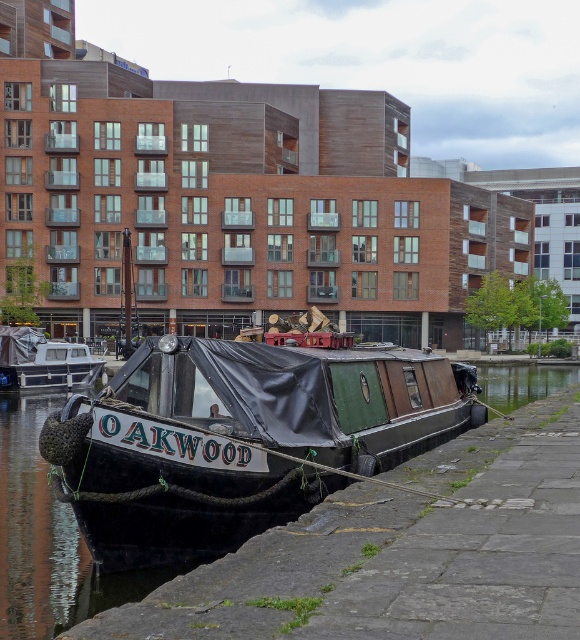
You are standing on the embankment and see both the black polished wood boat at center and the matte black boat at left. Which boat is closer to the modern building in the background?

The black polished wood boat at center is closer to the modern building in the background because it is positioned to the right of the matte black boat at left, which is further away from the building.

You are standing at the edge of the canal looking towards the modern building. There is a point marked at coordinates [241,438]. What object is located at this point?

The point at coordinates [241,438] marks the location of the black polished wood boat at center.